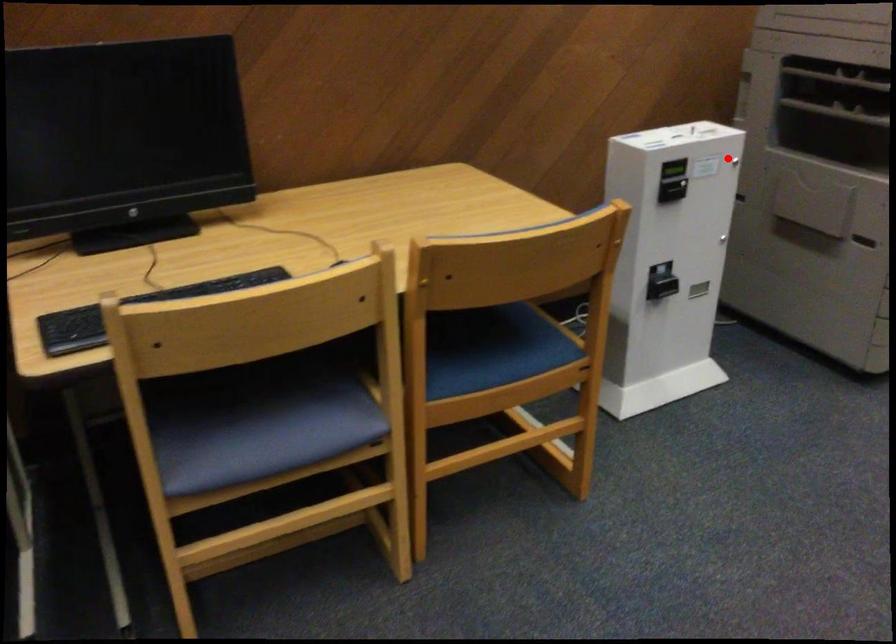
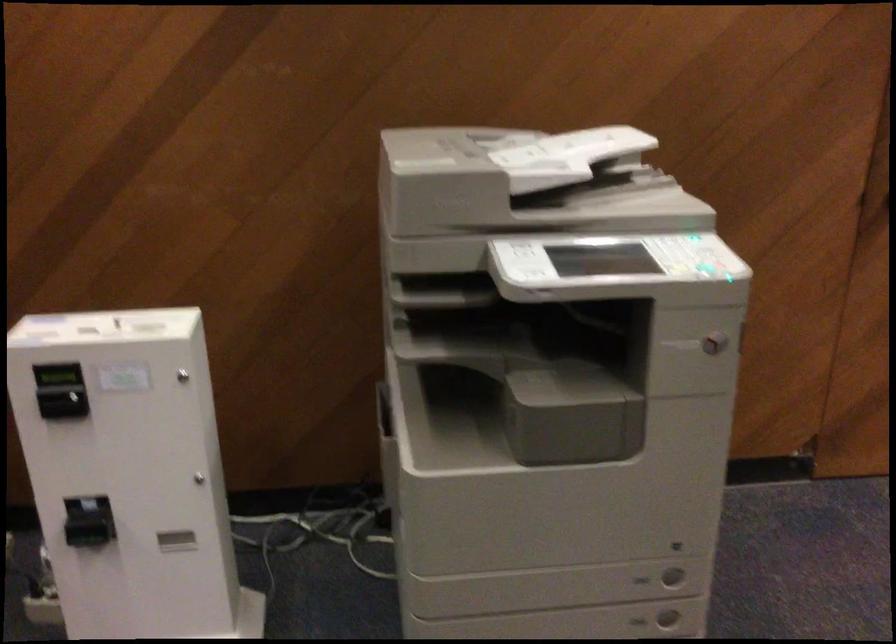
Question: I am providing you with two images of the same scene from different viewpoints. In image1, a red point is highlighted. Considering the same 3D point in image2, which of the following is correct?

Choices:
 (A) It is closer
 (B) It is farther

Answer: (A)